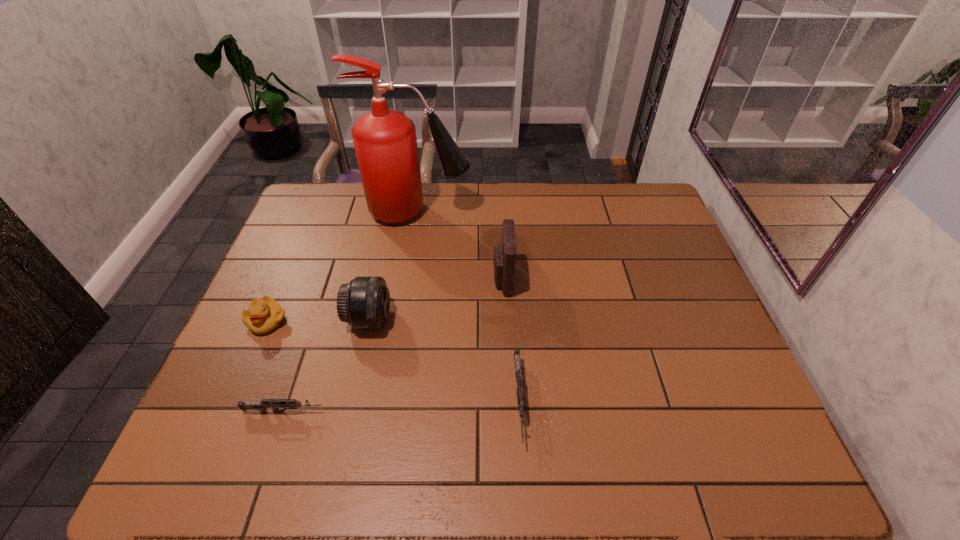
Given the evenly spaced guns in the image, where should an extra gun be added on the right to preserve the spacing? Please point to a vacant space. Please provide its 2D coordinates. Your answer should be formatted as a tuple, i.e. [(x, y)], where the tuple contains the x and y coordinates of a point satisfying the conditions above.

[(745, 390)]